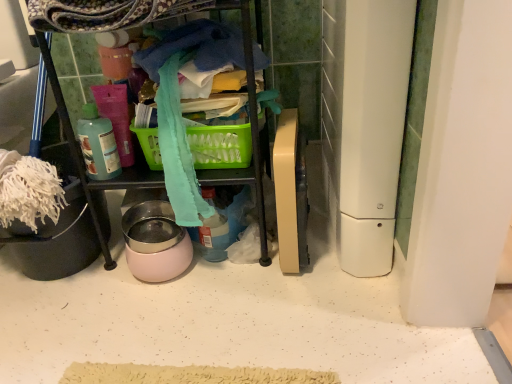
Question: From the image's perspective, is white plastic appliance at right, the 1th appliance when ordered from right to left, above pink glossy bowl at center, arranged as the 2th appliance when viewed from the right?

Choices:
 (A) no
 (B) yes

Answer: (B)

Question: Is white plastic appliance at right, the 2th appliance from the left, smaller than pink glossy bowl at center, the first appliance when ordered from left to right?

Choices:
 (A) no
 (B) yes

Answer: (A)

Question: Are white plastic appliance at right, the 1th appliance when ordered from right to left, and pink glossy bowl at center, arranged as the 2th appliance when viewed from the right, far apart?

Choices:
 (A) yes
 (B) no

Answer: (B)

Question: From a real-world perspective, is white plastic appliance at right, the 1th appliance when ordered from right to left, positioned under pink glossy bowl at center, the first appliance when ordered from left to right, based on gravity?

Choices:
 (A) yes
 (B) no

Answer: (B)

Question: From a real-world perspective, is white plastic appliance at right, the 2th appliance from the left, located higher than pink glossy bowl at center, the first appliance when ordered from left to right?

Choices:
 (A) yes
 (B) no

Answer: (A)

Question: Is white plastic appliance at right, the 2th appliance from the left, taller or shorter than translucent plastic bottle at upper left?

Choices:
 (A) short
 (B) tall

Answer: (B)

Question: Considering the positions of point (352, 11) and point (105, 140), is point (352, 11) closer or farther from the camera than point (105, 140)?

Choices:
 (A) closer
 (B) farther

Answer: (A)

Question: In the image, is white plastic appliance at right, the 2th appliance from the left, on the left side or the right side of translucent plastic bottle at upper left?

Choices:
 (A) right
 (B) left

Answer: (A)

Question: From a real-world perspective, is white plastic appliance at right, the 2th appliance from the left, positioned above or below translucent plastic bottle at upper left?

Choices:
 (A) above
 (B) below

Answer: (B)

Question: Is translucent plastic bottle at upper left wider or thinner than green plastic picnic basket at center?

Choices:
 (A) wide
 (B) thin

Answer: (B)

Question: Would you say translucent plastic bottle at upper left is to the left or to the right of green plastic picnic basket at center in the picture?

Choices:
 (A) left
 (B) right

Answer: (A)

Question: Is translucent plastic bottle at upper left bigger or smaller than green plastic picnic basket at center?

Choices:
 (A) small
 (B) big

Answer: (A)

Question: From a real-world perspective, is translucent plastic bottle at upper left physically located above or below green plastic picnic basket at center?

Choices:
 (A) above
 (B) below

Answer: (A)

Question: Is point (134, 129) positioned closer to the camera than point (349, 180)?

Choices:
 (A) farther
 (B) closer

Answer: (A)

Question: Based on their positions, is green plastic picnic basket at center located to the left or right of white plastic appliance at right, the 2th appliance from the left?

Choices:
 (A) right
 (B) left

Answer: (B)